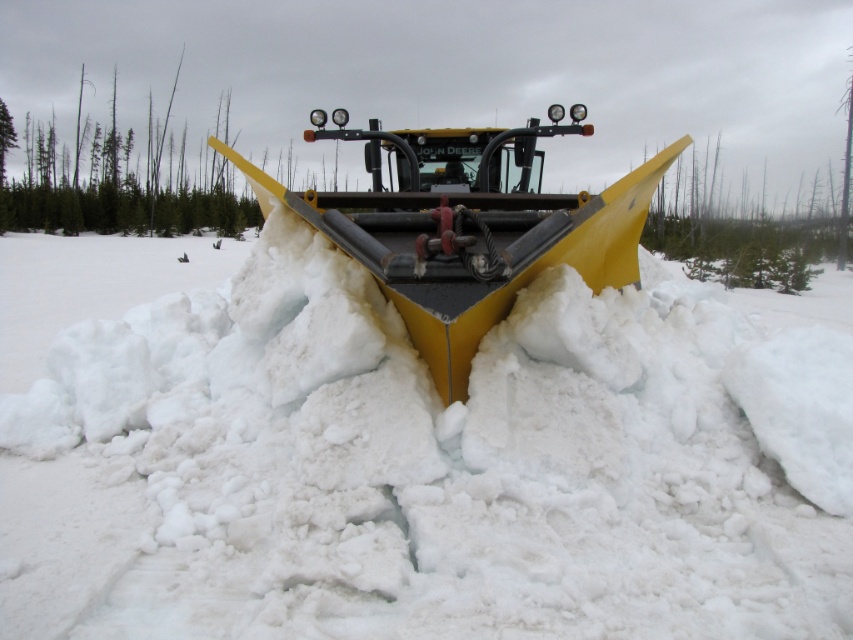
Question: Among these points, which one is nearest to the camera?

Choices:
 (A) (500, 224)
 (B) (126, 403)

Answer: (A)

Question: Can you confirm if white fluffy snow at center is positioned to the left of yellow matte snowplow at center?

Choices:
 (A) yes
 (B) no

Answer: (A)

Question: Is white fluffy snow at center to the right of yellow matte snowplow at center from the viewer's perspective?

Choices:
 (A) yes
 (B) no

Answer: (B)

Question: In this image, where is white fluffy snow at center located relative to yellow matte snowplow at center?

Choices:
 (A) left
 (B) right

Answer: (A)

Question: Which point appears farthest from the camera in this image?

Choices:
 (A) (547, 131)
 (B) (519, 588)

Answer: (A)